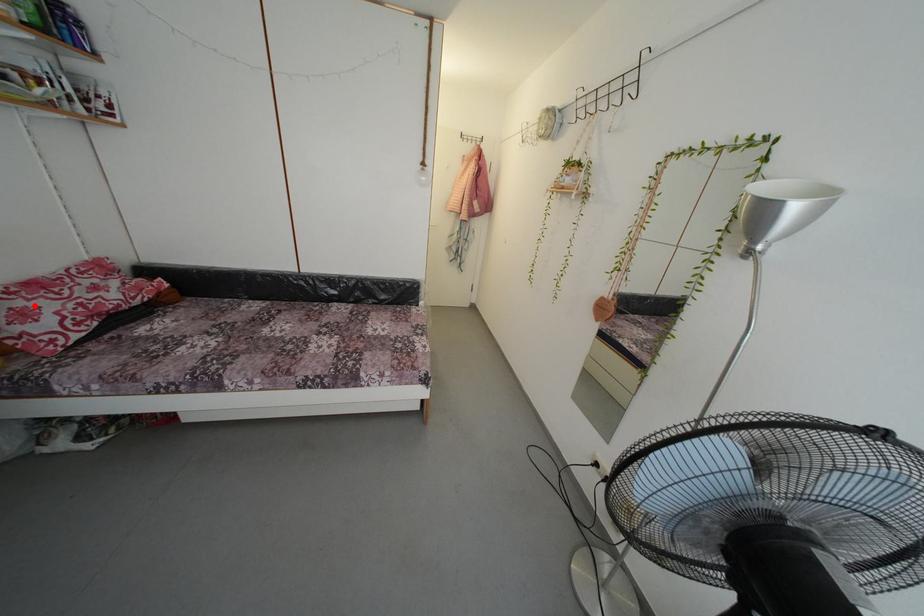
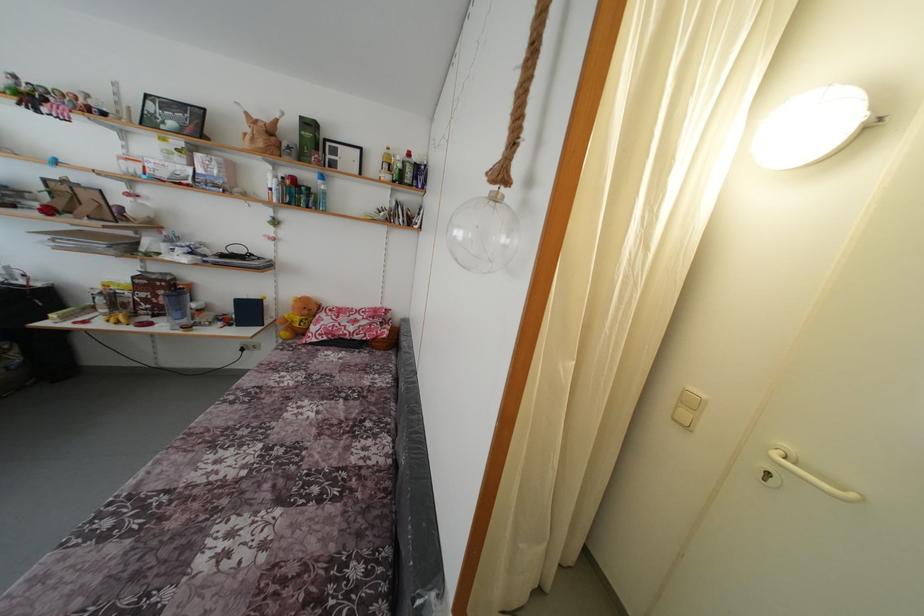
The point at the highlighted location is marked in the first image. Where is the corresponding point in the second image?

(332, 321)